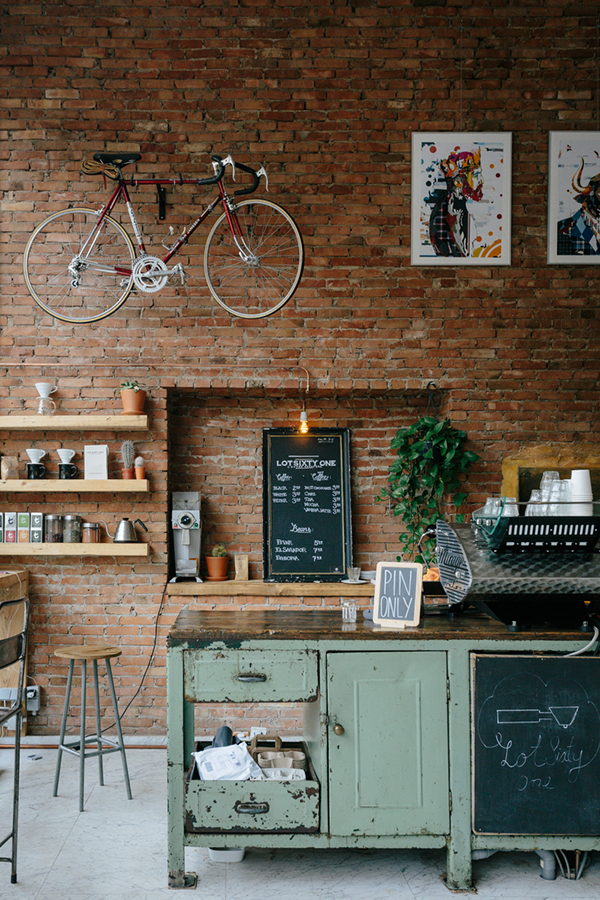
At what (x,y) coordinates should I click in order to perform the action: click on frames. Please return your answer as a coordinate pair (x, y). Looking at the image, I should click on (348, 466), (378, 583).